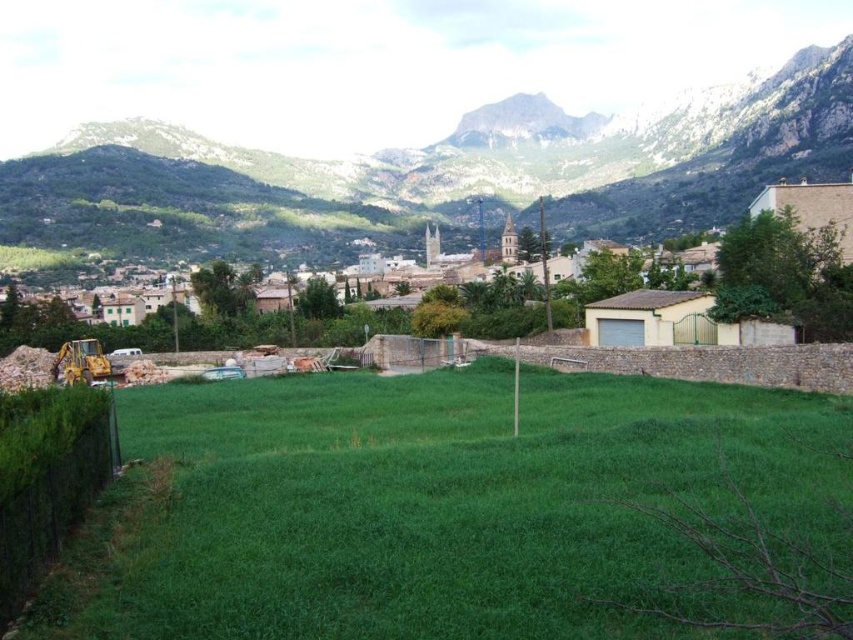
Question: Among these objects, which one is nearest to the camera?

Choices:
 (A) yellow metallic excavator at lower left
 (B) green grassy field at lower left

Answer: (B)

Question: Which of these objects is positioned farthest from the green grassy field at lower left?

Choices:
 (A) rocky brown mountain at upper center
 (B) yellow metallic excavator at lower left

Answer: (A)

Question: Does green grassy field at lower left have a larger size compared to yellow metallic excavator at lower left?

Choices:
 (A) yes
 (B) no

Answer: (A)

Question: Can you confirm if rocky brown mountain at upper center is positioned above yellow metallic excavator at lower left?

Choices:
 (A) no
 (B) yes

Answer: (B)

Question: Can you confirm if green grassy field at lower left is positioned to the right of rocky brown mountain at upper center?

Choices:
 (A) yes
 (B) no

Answer: (B)

Question: Which point is farther to the camera?

Choices:
 (A) yellow metallic excavator at lower left
 (B) rocky brown mountain at upper center
 (C) green grassy field at lower left

Answer: (B)